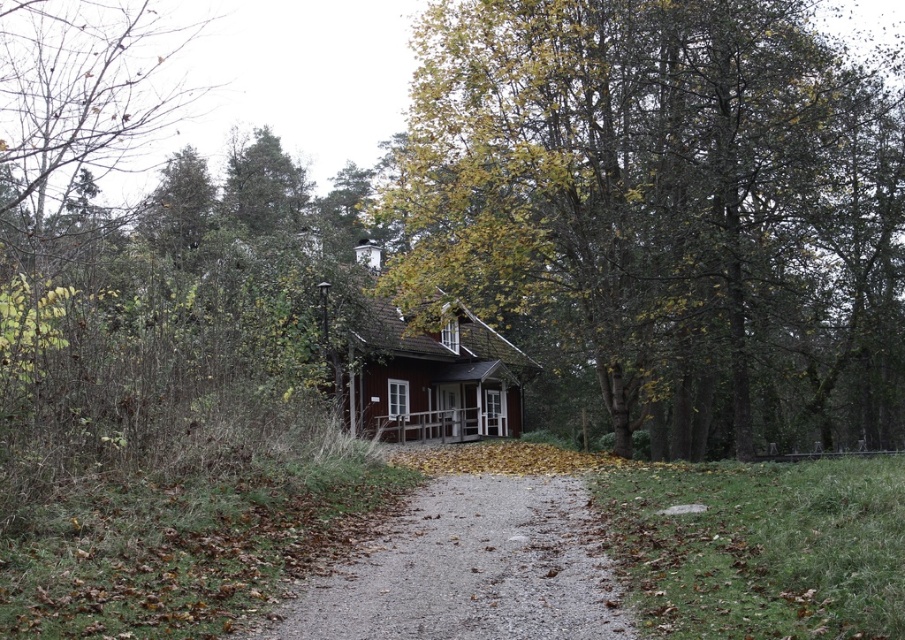
You are standing on the gravel path leading to the wooden cottage at center. Looking towards the green leafy tree at center, which one appears taller from your perspective?

The green leafy tree at center appears much taller than the wooden cottage at center from your perspective.

You are a hiker carrying a heavy backpack and need to reach the house. You see the green leafy tree at center and the gray gravel path at center. Which direction should you walk to get closer to the house?

The gray gravel path at center is closer to the house than the green leafy tree at center. Therefore, you should walk towards the gray gravel path at center to get closer to the house.